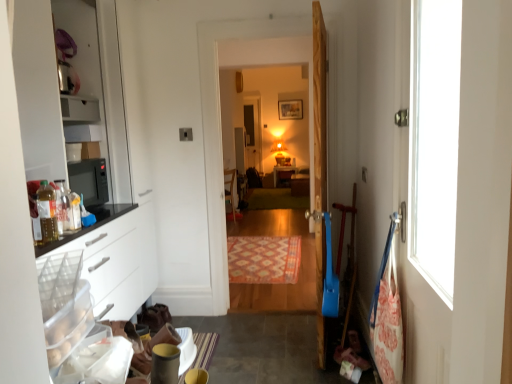
Locate an element on the screen. blank space situated above patterned carpet at center, the 1th mat in the front-to-back sequence (from a real-world perspective) is located at coordinates (261, 249).